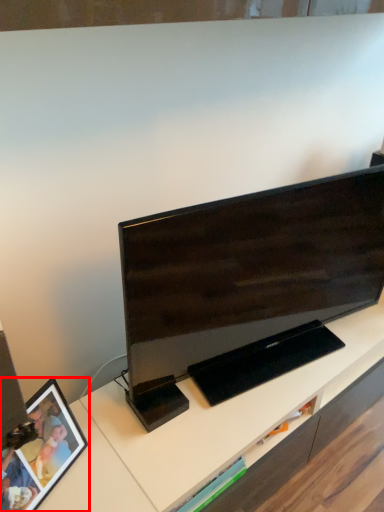
Question: From the image's perspective, where is picture frame (annotated by the red box) located in relation to television in the image?

Choices:
 (A) above
 (B) below

Answer: (B)